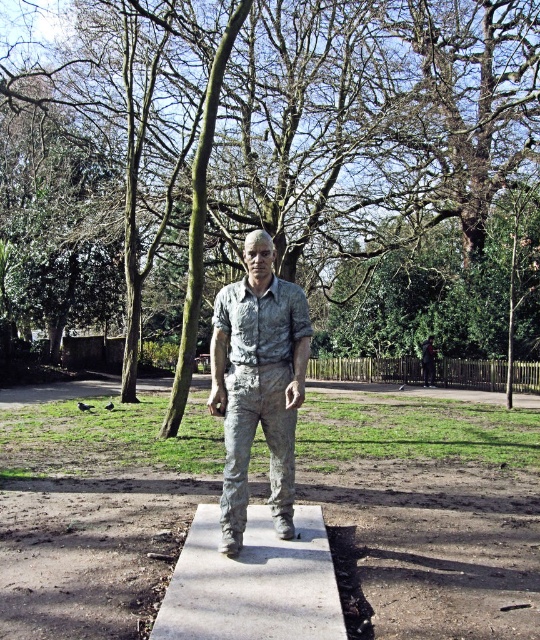
Looking at this image, you are a park visitor who wants to take a photo of the bronze statue at center without the green mossy tree at center appearing in the frame. Which direction should you move to achieve this?

The green mossy tree at center is to the left of the bronze statue at center. To avoid the tree in your photo, move to the right side of the bronze statue at center.

You are a park maintenance worker who needs to place a new bench. The bench is 1.5 meters long. You see the concreteroughconcrete at center and the matte silver statue at center. Which surface can accommodate the bench without overhanging?

The matte silver statue at center is larger than the concreteroughconcrete at center. Since the bench is 1.5 meters long, the matte silver statue at center has enough space to accommodate it without overhanging.

You are an artist planning to place a new sculpture in the park. You have a choice between a bronze statue at center and a concreteroughconcrete at center. If you want to choose the narrower option, which one should you select?

The bronze statue at center is thinner than concreteroughconcrete at center, so you should select the bronze statue at center as it is the narrower option.